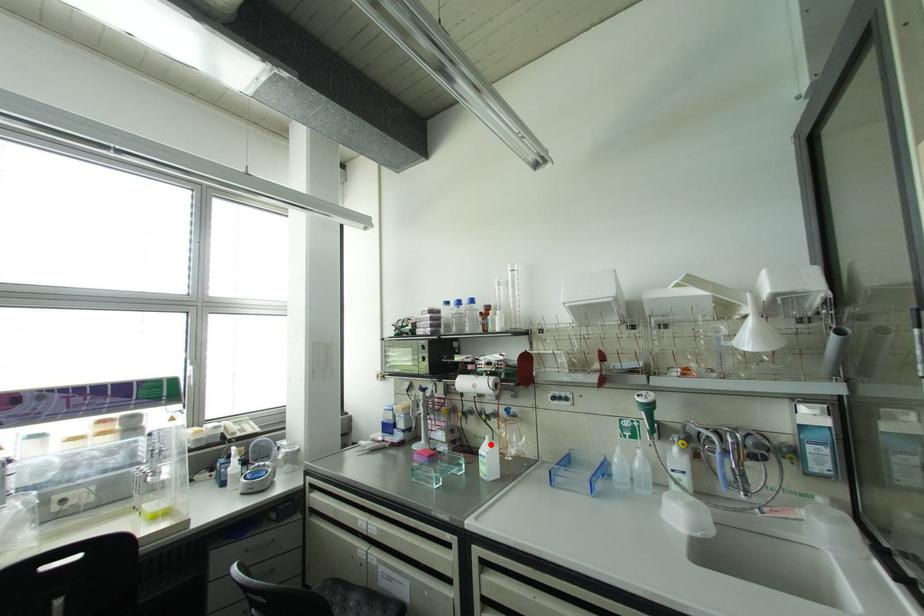
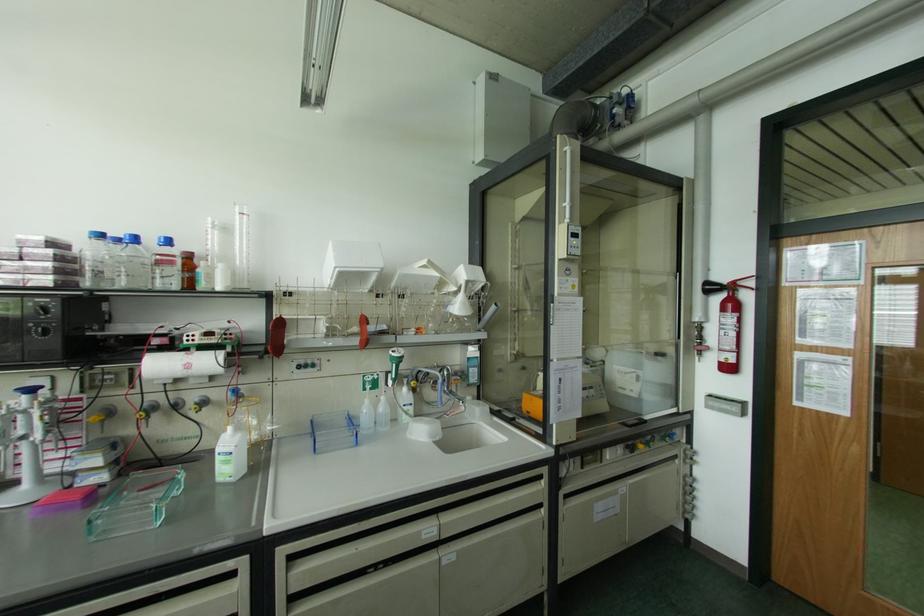
The point at the highlighted location is marked in the first image. Where is the corresponding point in the second image?

(238, 435)